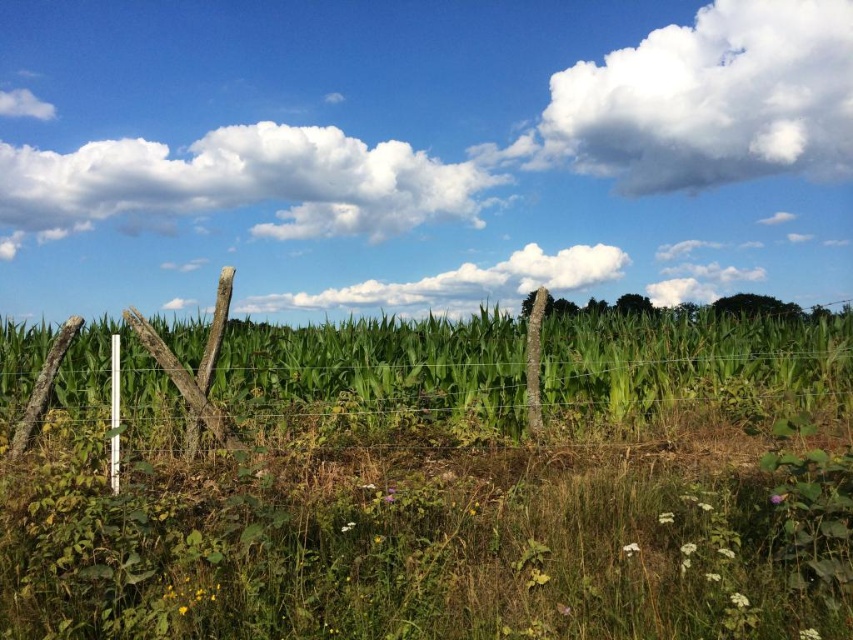
Is green leafy corn at center to the left of white fluffy cloud at upper left from the viewer's perspective?

Incorrect, green leafy corn at center is not on the left side of white fluffy cloud at upper left.

Is point (614, 364) positioned before point (15, 156)?

Yes, point (614, 364) is closer to viewer.

The image size is (853, 640). I want to click on green leafy corn at center, so click(x=693, y=362).

How far apart are green grass at center and white fluffy cloud at upper left?

green grass at center is 13.03 meters from white fluffy cloud at upper left.

This screenshot has height=640, width=853. Describe the element at coordinates (430, 545) in the screenshot. I see `green grass at center` at that location.

Is point (840, 474) positioned in front of point (93, 180)?

Yes.

What are the coordinates of `green grass at center` in the screenshot? It's located at (430, 545).

Does green leafy corn at center appear on the right side of white fluffy cloud at center?

Correct, you'll find green leafy corn at center to the right of white fluffy cloud at center.

Does green leafy corn at center lie in front of white fluffy cloud at center?

Yes.

This screenshot has width=853, height=640. Describe the element at coordinates (693, 362) in the screenshot. I see `green leafy corn at center` at that location.

The height and width of the screenshot is (640, 853). I want to click on green leafy corn at center, so click(x=693, y=362).